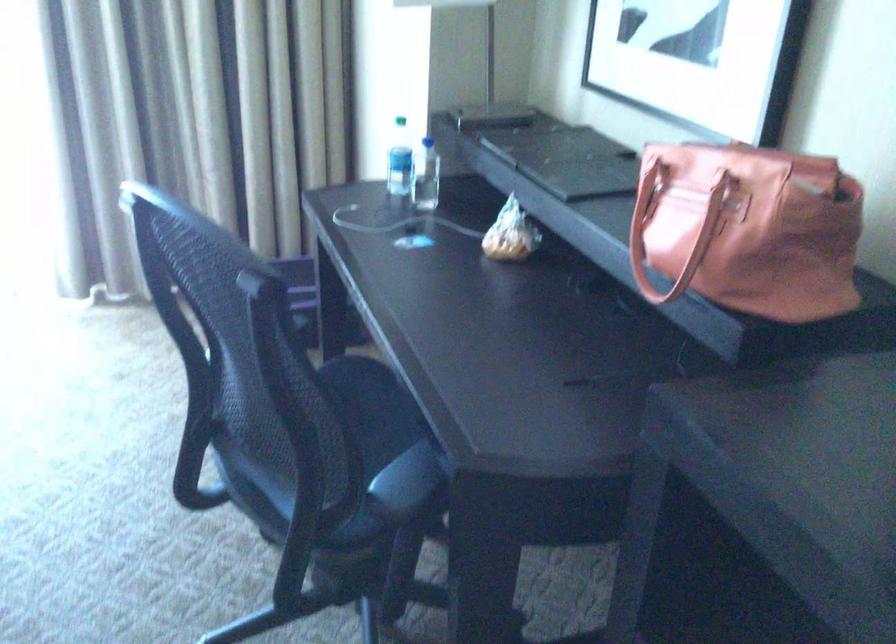
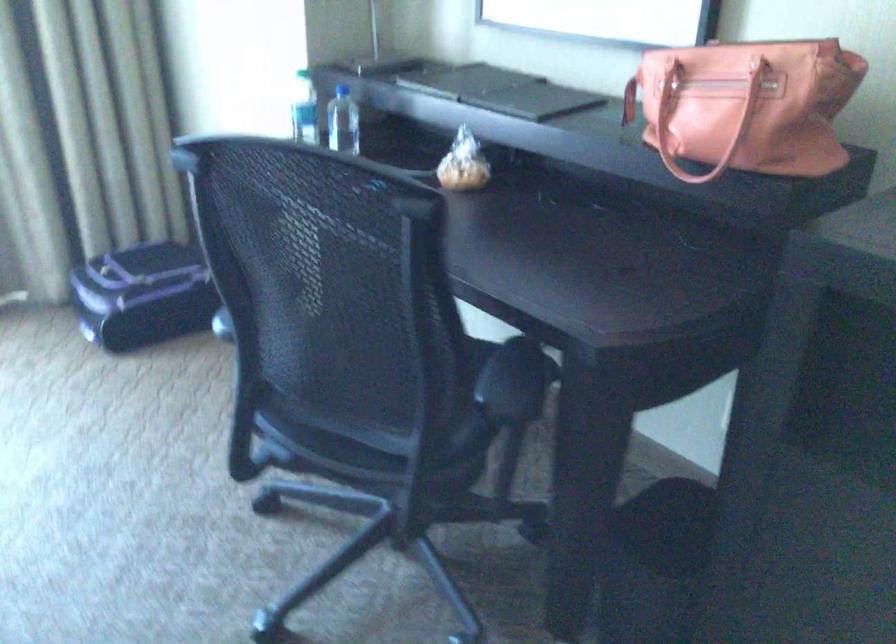
Find the pixel in the second image that matches pixel 509 237 in the first image.

(462, 164)